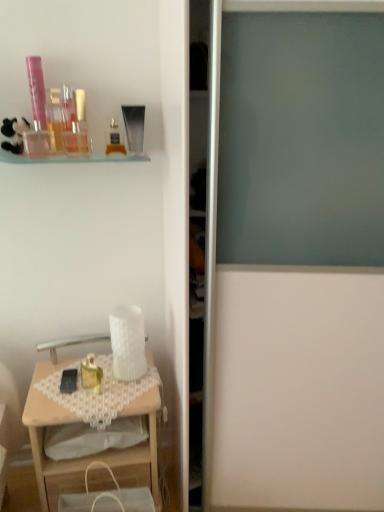
The width and height of the screenshot is (384, 512). In order to click on vacant area on the back side of black matte mobile phone at lower left in this screenshot , I will do `click(78, 361)`.